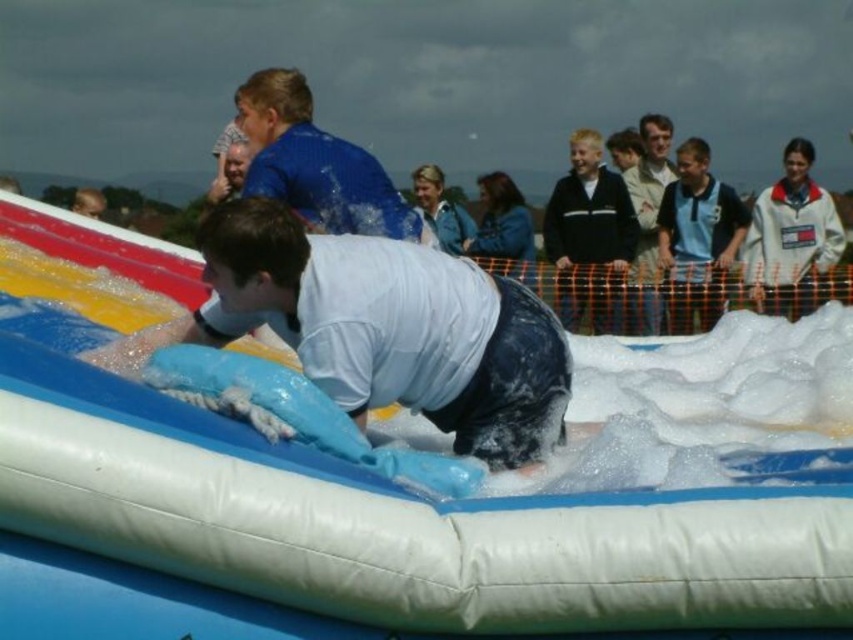
You are organizing a group photo and need to arrange participants from left to right based on their width. If you have the blue smooth shirt at upper center and the blue jersey at upper right, which should be placed on the left side to accommodate their widths?

The blue smooth shirt at upper center should be placed on the left side because it might be wider than the blue jersey at upper right, allowing enough space for both in the group photo arrangement.

You are organizing a slip and slide event and need to ensure there is enough space for all participants. Given the white matte shirt at center and the light brown leather jacket at upper center, which object takes up more area in the image?

The light brown leather jacket at upper center takes up more area in the image than the white matte shirt at center.

Based on the photo, you are standing at the point labeled point (630, 192) and want to throw a ball to someone standing at point (598, 196). Considering the perspective of the image, will the ball travel towards the camera or away from it?

The ball will travel towards the camera because point (598, 196) is closer to the camera than point (630, 192).